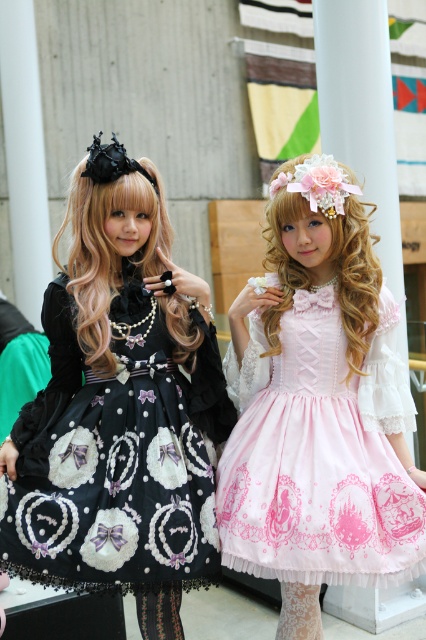
Question: Which object is farther from the camera taking this photo?

Choices:
 (A) pink satin dress at center
 (B) lace fabric skirt at center

Answer: (B)

Question: Considering the real-world distances, which object is farthest from the pink satin dress at center?

Choices:
 (A) black lace dress at left
 (B) lace fabric skirt at center

Answer: (B)

Question: Among these points, which one is nearest to the camera?

Choices:
 (A) (244, 467)
 (B) (100, 435)
 (C) (282, 637)

Answer: (B)

Question: Does black lace dress at left have a larger size compared to pink satin dress at center?

Choices:
 (A) yes
 (B) no

Answer: (B)

Question: Can you confirm if pink satin dress at center is positioned below lace fabric skirt at center?

Choices:
 (A) no
 (B) yes

Answer: (A)

Question: Does pink satin dress at center appear under lace fabric skirt at center?

Choices:
 (A) yes
 (B) no

Answer: (B)